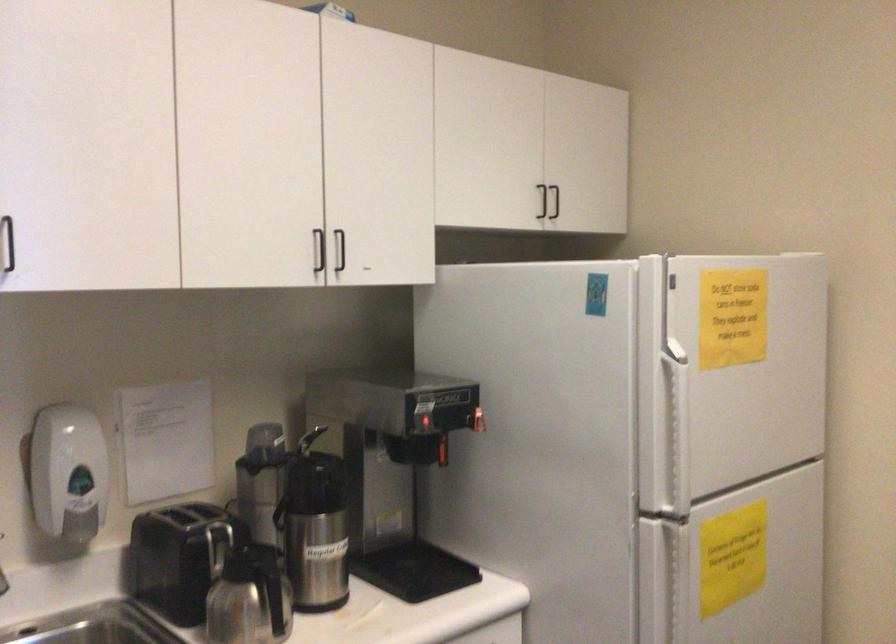
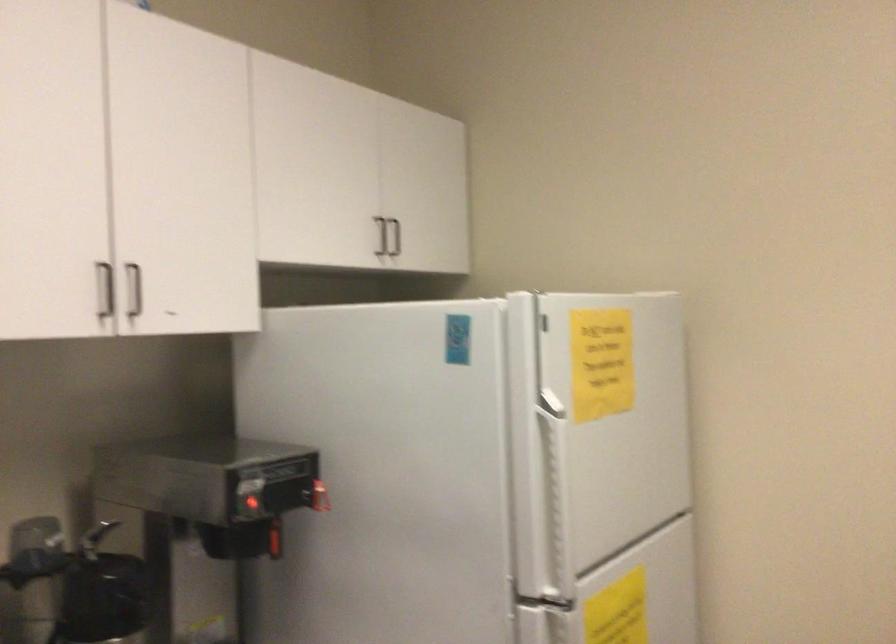
The point at (442, 456) is marked in the first image. Where is the corresponding point in the second image?

(273, 541)